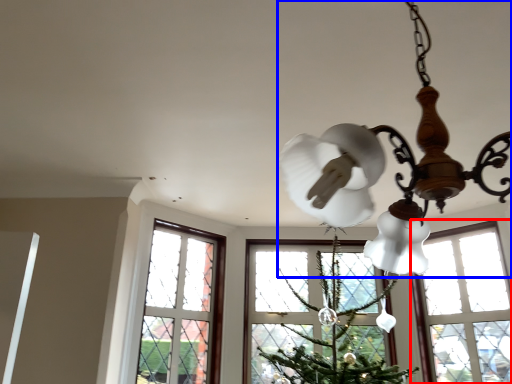
Question: Which object is closer to the camera taking this photo, window (highlighted by a red box) or lamp (highlighted by a blue box)?

Choices:
 (A) window
 (B) lamp

Answer: (B)